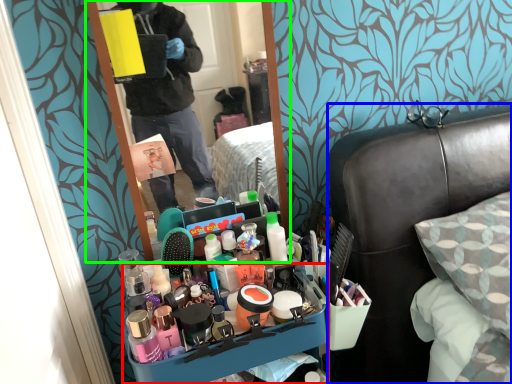
Question: Estimate the real-world distances between objects in this image. Which object is farther from desk (highlighted by a red box), furniture (highlighted by a blue box) or mirror (highlighted by a green box)?

Choices:
 (A) furniture
 (B) mirror

Answer: (B)